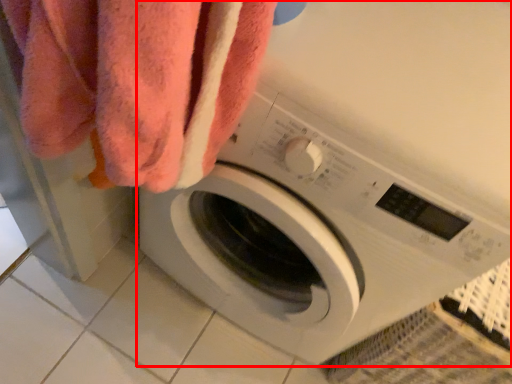
Question: Considering the relative positions of washing machine (annotated by the red box) and towel in the image provided, where is washing machine (annotated by the red box) located with respect to the staircase?

Choices:
 (A) left
 (B) right

Answer: (B)